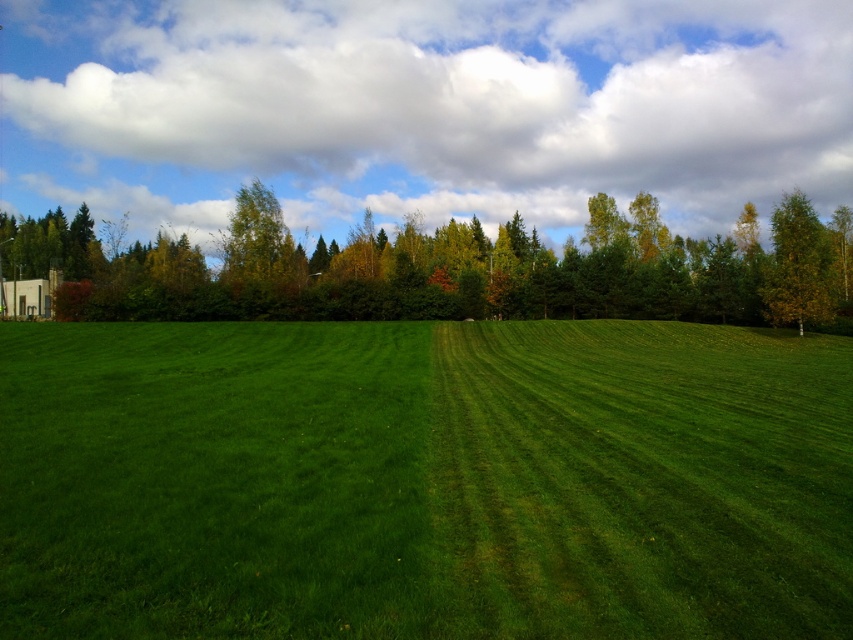
You are standing at the origin point in the coordinate system of this image. You want to walk to the green grass at center. Which direction should you move in to reach it?

Since the green grass at center is located at point (424, 481), you should move towards the right direction from your current position at the origin to reach it.